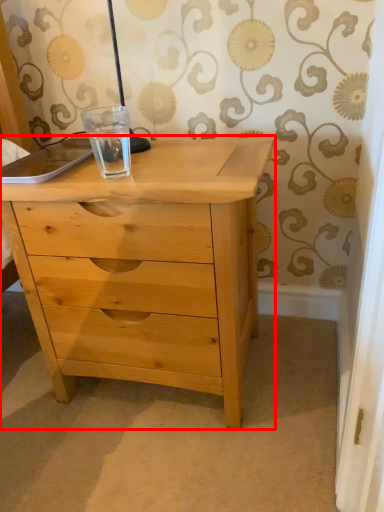
Question: Where is chest of drawers (annotated by the red box) located in relation to glass jar in the image?

Choices:
 (A) left
 (B) right

Answer: (B)